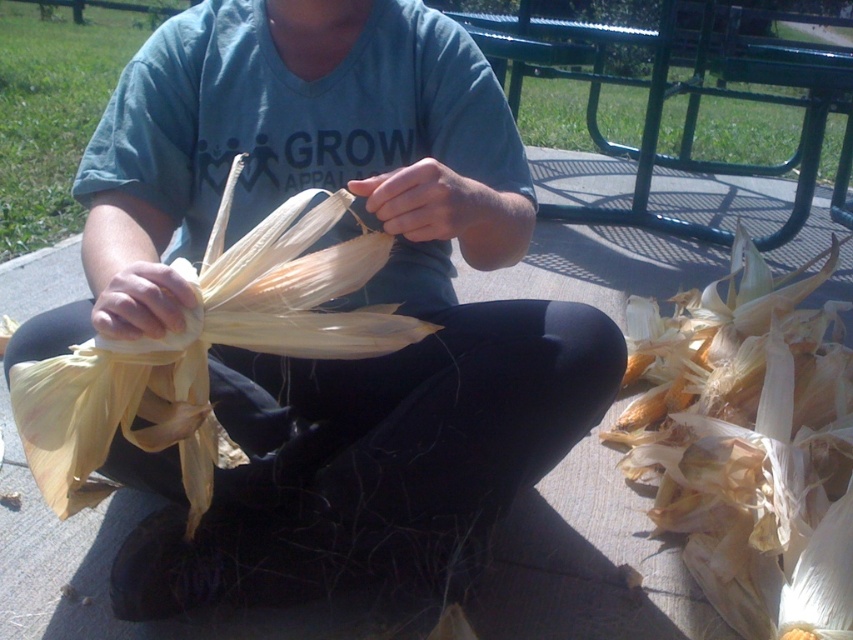
You are a farmer checking corn husks for quality. You find a matte yellow corn husk at center and yellow papery corn husks at lower right. Which one has a larger width?

The matte yellow corn husk at center might be wider than yellow papery corn husks at lower right.

You are a farmer who needs to determine which item is larger between the matte yellow corn husk at center and the yellow papery corn at center. Based on the scene, which one is bigger?

The matte yellow corn husk at center is bigger than the yellow papery corn at center according to the description.

You are a farmer who wants to organize the corn husks based on their size. You have two piles of husks in front of you. One is the matte yellow corn husk at center and the other is the yellow papery corn husks at lower right. Which pile has taller husks?

The matte yellow corn husk at center has a greater height compared to the yellow papery corn husks at lower right, so the pile with the matte yellow corn husk at center has taller husks.